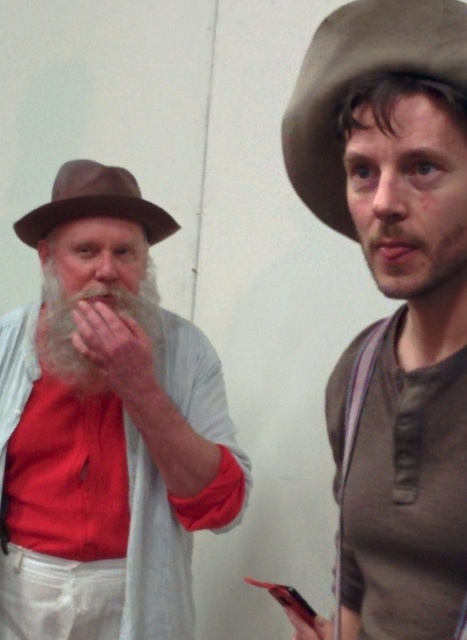
Question: Considering the relative positions of brown felt cowboy hat at upper right and gray matte beard at right in the image provided, where is brown felt cowboy hat at upper right located with respect to gray matte beard at right?

Choices:
 (A) above
 (B) below

Answer: (A)

Question: Does brown felt hat at upper right have a larger size compared to brown felt fedora at left?

Choices:
 (A) no
 (B) yes

Answer: (B)

Question: Which point is closer to the camera taking this photo?

Choices:
 (A) (373, 32)
 (B) (367, 76)
 (C) (142, 321)
 (D) (401, 220)

Answer: (B)

Question: Which point appears farthest from the camera in this image?

Choices:
 (A) (93, 177)
 (B) (63, 358)
 (C) (412, 305)
 (D) (335, 88)

Answer: (B)

Question: Is matte brown hat at left bigger than gray matte beard at right?

Choices:
 (A) no
 (B) yes

Answer: (B)

Question: Which point is farther to the camera?

Choices:
 (A) matte brown hat at left
 (B) brown felt cowboy hat at upper right
 (C) white soft beard at left
 (D) brown felt fedora at left

Answer: (D)